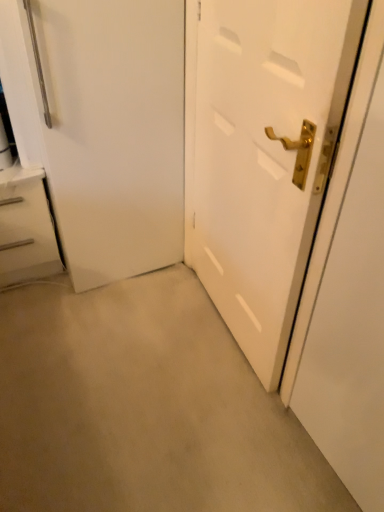
The height and width of the screenshot is (512, 384). Describe the element at coordinates (26, 227) in the screenshot. I see `white glossy chest of drawers at left` at that location.

I want to click on white glossy chest of drawers at left, so click(26, 227).

Is white glossy chest of drawers at left aimed at white matte door at center?

No, white glossy chest of drawers at left is not facing towards white matte door at center.

How many degrees apart are the facing directions of white glossy chest of drawers at left and white matte door at center?

The angular difference between white glossy chest of drawers at left and white matte door at center is 92.3 degrees.

Is white glossy chest of drawers at left far from white matte door at center?

That's not correct — white glossy chest of drawers at left is a little close to white matte door at center.

Can you confirm if white glossy chest of drawers at left is wider than white glossy door handle at right?

Yes.

Can you tell me how much white glossy chest of drawers at left and white glossy door handle at right differ in facing direction?

91.2 degrees.

From the image's perspective, which is above, white glossy chest of drawers at left or white glossy door handle at right?

white glossy chest of drawers at left.

Who is shorter, white glossy chest of drawers at left or white glossy door handle at right?

With less height is white glossy chest of drawers at left.

Considering the positions of objects white glossy door handle at right and white matte door at center in the image provided, who is behind, white glossy door handle at right or white matte door at center?

white matte door at center.

Which of these two, white glossy door handle at right or white matte door at center, stands shorter?

white matte door at center is shorter.

From a real-world perspective, is white glossy door handle at right on white matte door at center?

Yes, from a real-world perspective, white glossy door handle at right is above white matte door at center.

Does white glossy door handle at right appear on the left side of white matte door at center?

No.

Can you tell me how much white matte door at center and white glossy chest of drawers at left differ in facing direction?

The angular difference between white matte door at center and white glossy chest of drawers at left is 92.3 degrees.

In the scene shown: Does white matte door at center have a greater height compared to white glossy chest of drawers at left?

Correct, white matte door at center is much taller as white glossy chest of drawers at left.

Is white matte door at center facing towards white glossy chest of drawers at left?

No.

From the image's perspective, is white matte door at center above white glossy chest of drawers at left?

Yes.

Considering the relative sizes of white matte door at center and white glossy door handle at right in the image provided, is white matte door at center wider than white glossy door handle at right?

No, white matte door at center is not wider than white glossy door handle at right.

Consider the image. Can you tell me how much white matte door at center and white glossy door handle at right differ in facing direction?

white matte door at center and white glossy door handle at right are facing 1.12 degrees away from each other.

Is point (298, 83) positioned after point (354, 311)?

No, it is not.

Is white matte door at center positioned before white glossy door handle at right?

No, it is not.

In the scene shown: Is white glossy door handle at right at the left side of white glossy chest of drawers at left?

Incorrect, white glossy door handle at right is not on the left side of white glossy chest of drawers at left.

The image size is (384, 512). I want to click on screen door below the white glossy chest of drawers at left (from the image's perspective), so click(x=348, y=295).

Is white glossy door handle at right facing towards white glossy chest of drawers at left?

No, white glossy door handle at right does not turn towards white glossy chest of drawers at left.

Which is behind, white glossy door handle at right or white glossy chest of drawers at left?

white glossy chest of drawers at left is further from the camera.

The width and height of the screenshot is (384, 512). Find the location of `door that is on the right side of white glossy chest of drawers at left`. door that is on the right side of white glossy chest of drawers at left is located at coordinates (262, 154).

I want to click on chest of drawers below the white glossy door handle at right (from a real-world perspective), so click(26, 227).

Considering their positions, is white glossy door handle at right positioned closer to white glossy chest of drawers at left than white matte door at center?

Based on the image, white matte door at center appears to be nearer to white glossy chest of drawers at left.

Estimate the real-world distances between objects in this image. Which object is closer to white matte door at center, white glossy chest of drawers at left or white glossy door handle at right?

white glossy door handle at right.

Estimate the real-world distances between objects in this image. Which object is closer to white matte door at center, white glossy door handle at right or white glossy chest of drawers at left?

white glossy door handle at right lies closer to white matte door at center than the other object.

Based on their spatial positions, is white glossy chest of drawers at left or white matte door at center closer to white glossy door handle at right?

white matte door at center.

Looking at the image, which one is located further to white glossy door handle at right, white matte door at center or white glossy chest of drawers at left?

white glossy chest of drawers at left is further to white glossy door handle at right.

Which object lies nearer to the anchor point white glossy chest of drawers at left, white matte door at center or white glossy door handle at right?

Among the two, white matte door at center is located nearer to white glossy chest of drawers at left.

You are a GUI agent. You are given a task and a screenshot of the screen. Output one action in this format:
    pyautogui.click(x=<x>, y=<y>)
    Task: Click on the door located between white glossy chest of drawers at left and white glossy door handle at right in the left-right direction
    
    Given the screenshot: What is the action you would take?
    pyautogui.click(x=262, y=154)